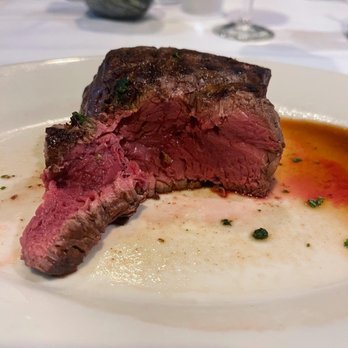
I want to click on white table area in rear of image, so click(x=60, y=33), click(x=304, y=17).